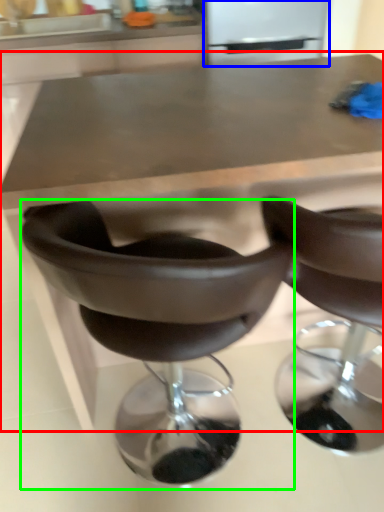
Question: Which is nearer to the table (highlighted by a red box)? appliance (highlighted by a blue box) or chair (highlighted by a green box).

Choices:
 (A) appliance
 (B) chair

Answer: (B)